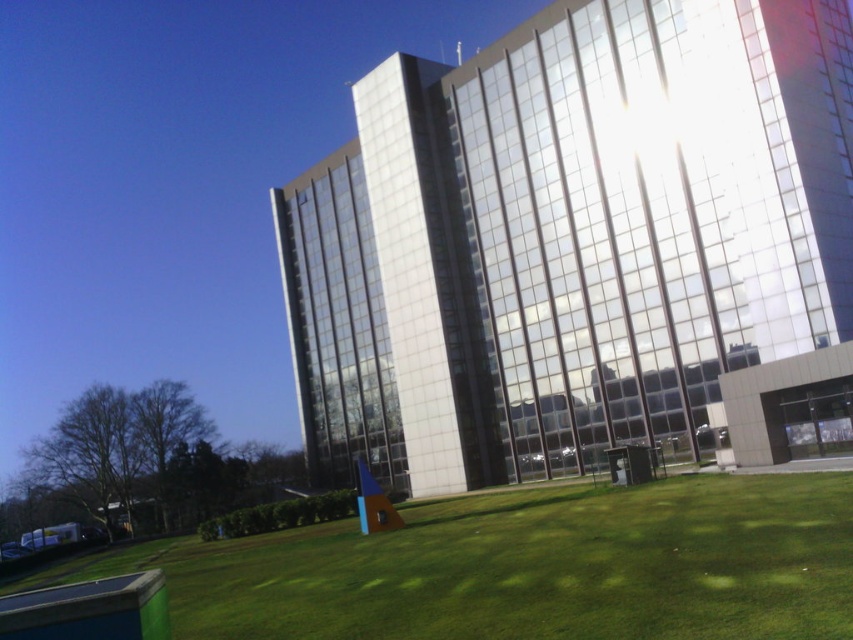
You are a landscape architect designing a new park. You want to place a new statue that is 2 meters tall in the scene. Considering the relative sizes of the glassy reflective building at center and the green grass at lower center, where should you place the statue to ensure it is proportionally appropriate with the existing elements?

The glassy reflective building at center is larger than the green grass at lower center. To maintain proportion, the statue should be placed near the green grass at lower center since it is smaller and the statue size would complement the scale of the grass area better.

You are standing in front of the modern building and want to walk from point A to point B. Point A is located at coordinates point (503, 333) and point B is at point (86, 564). Which direction should you move to get from point A to point B?

To move from point A to point B, you should move downward and to the right since point B is positioned lower and further to the right compared to point A.

Based on the scene description, if you are standing on the green grass at lower center, which direction should you walk to face the glassy reflective building at center?

You should walk to your right because the glassy reflective building at center is to the right of the green grass at lower center.